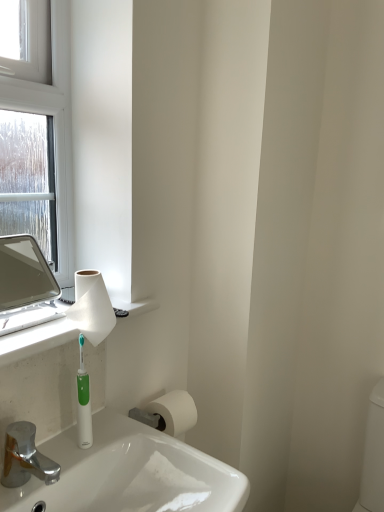
Question: Does chrome metallic faucet at lower left have a lesser width compared to white matte toilet paper at lower center, positioned as the first toilet paper in bottom-to-top order?

Choices:
 (A) no
 (B) yes

Answer: (A)

Question: Is chrome metallic faucet at lower left further to camera compared to white matte toilet paper at lower center, the 2th toilet paper when ordered from top to bottom?

Choices:
 (A) yes
 (B) no

Answer: (B)

Question: Are chrome metallic faucet at lower left and white matte toilet paper at lower center, the 2th toilet paper when ordered from top to bottom, beside each other?

Choices:
 (A) no
 (B) yes

Answer: (A)

Question: Is chrome metallic faucet at lower left completely or partially outside of white matte toilet paper at lower center, the 2th toilet paper when ordered from top to bottom?

Choices:
 (A) yes
 (B) no

Answer: (A)

Question: Is chrome metallic faucet at lower left facing towards white matte toilet paper at lower center, acting as the 1th toilet paper starting from the back?

Choices:
 (A) no
 (B) yes

Answer: (A)

Question: From the image's perspective, is green plastic toothbrush at lower left positioned above or below white matte toilet paper at lower center, the 1th toilet paper in the right-to-left sequence?

Choices:
 (A) above
 (B) below

Answer: (A)

Question: Considering the positions of point (87, 394) and point (185, 401), is point (87, 394) closer or farther from the camera than point (185, 401)?

Choices:
 (A) farther
 (B) closer

Answer: (B)

Question: In the image, is green plastic toothbrush at lower left on the left side or the right side of white matte toilet paper at lower center, the 1th toilet paper in the right-to-left sequence?

Choices:
 (A) right
 (B) left

Answer: (B)

Question: Is green plastic toothbrush at lower left inside the boundaries of white matte toilet paper at lower center, positioned as the first toilet paper in bottom-to-top order, or outside?

Choices:
 (A) outside
 (B) inside

Answer: (A)

Question: Visually, is white matte countertop at left positioned to the left or to the right of green plastic toothbrush at lower left?

Choices:
 (A) right
 (B) left

Answer: (B)

Question: From the image's perspective, relative to green plastic toothbrush at lower left, is white matte countertop at left above or below?

Choices:
 (A) above
 (B) below

Answer: (A)

Question: Does point (66, 330) appear closer or farther from the camera than point (79, 402)?

Choices:
 (A) farther
 (B) closer

Answer: (A)

Question: Based on their sizes in the image, would you say white matte countertop at left is bigger or smaller than green plastic toothbrush at lower left?

Choices:
 (A) small
 (B) big

Answer: (B)

Question: Is white paper towel at upper left, which appears as the 2th toilet paper when viewed from the back, situated inside matte silver mirror at left or outside?

Choices:
 (A) inside
 (B) outside

Answer: (B)

Question: Looking at the image, does white paper towel at upper left, which appears as the second toilet paper when viewed from the right, seem bigger or smaller compared to matte silver mirror at left?

Choices:
 (A) big
 (B) small

Answer: (B)